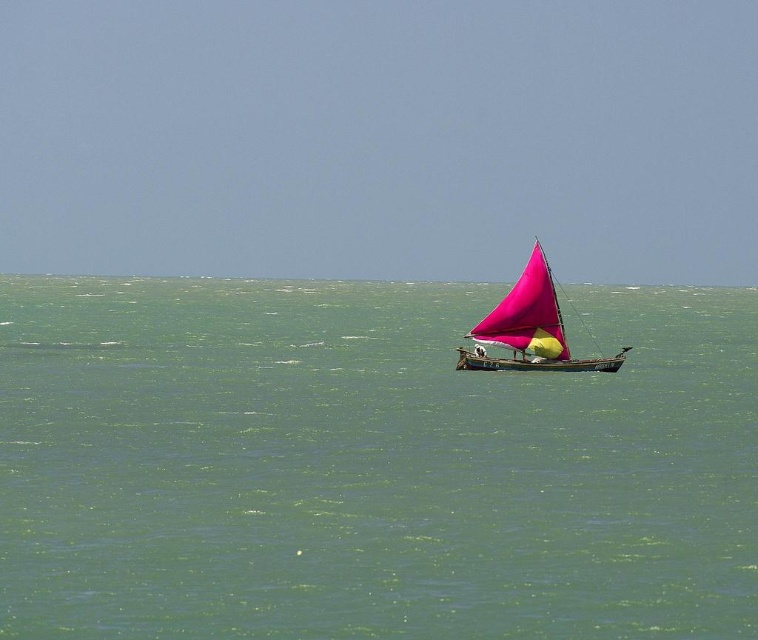
You are standing on a dock and see the green water at center and the pink fabric sailboat at center. Which object is positioned to the right?

The green water at center is to the right of the pink fabric sailboat at center, so the green water at center is positioned to the right.

You are an observer standing on the shore looking at the seascape. Which object, the green water at center or the pink fabric sailboat at center, takes up more space in the image?

The green water at center has a larger size compared to the pink fabric sailboat at center, so it takes up more space in the image.